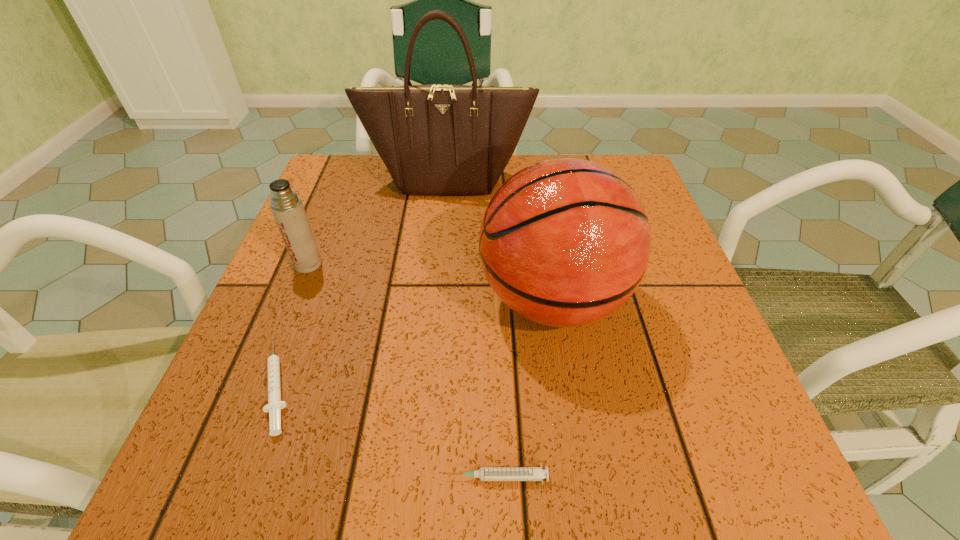
At what (x,y) coordinates should I click in order to perform the action: click on object present at the right edge. Please return your answer as a coordinate pair (x, y). This screenshot has height=540, width=960. Looking at the image, I should click on (564, 242).

Find the location of a particular element. The height and width of the screenshot is (540, 960). object that is at the far left corner is located at coordinates (436, 139).

Image resolution: width=960 pixels, height=540 pixels. I want to click on object at the near left corner, so click(274, 406).

Where is `free location at the far edge`? The height and width of the screenshot is (540, 960). free location at the far edge is located at coordinates (476, 200).

Image resolution: width=960 pixels, height=540 pixels. I want to click on vacant space at the left edge of the desktop, so click(x=348, y=321).

The width and height of the screenshot is (960, 540). Identify the location of free space at the right edge. (708, 355).

In the image, there is a desktop. Find the location of `vacant space at the far left corner`. vacant space at the far left corner is located at coordinates (356, 185).

This screenshot has width=960, height=540. In the image, there is a desktop. What are the coordinates of `blank space at the near left corner` in the screenshot? It's located at (276, 456).

Image resolution: width=960 pixels, height=540 pixels. Identify the location of free space at the near right corner. (726, 447).

Find the location of a particular element. free space between the farther syringe and the thermos bottle is located at coordinates coord(293,324).